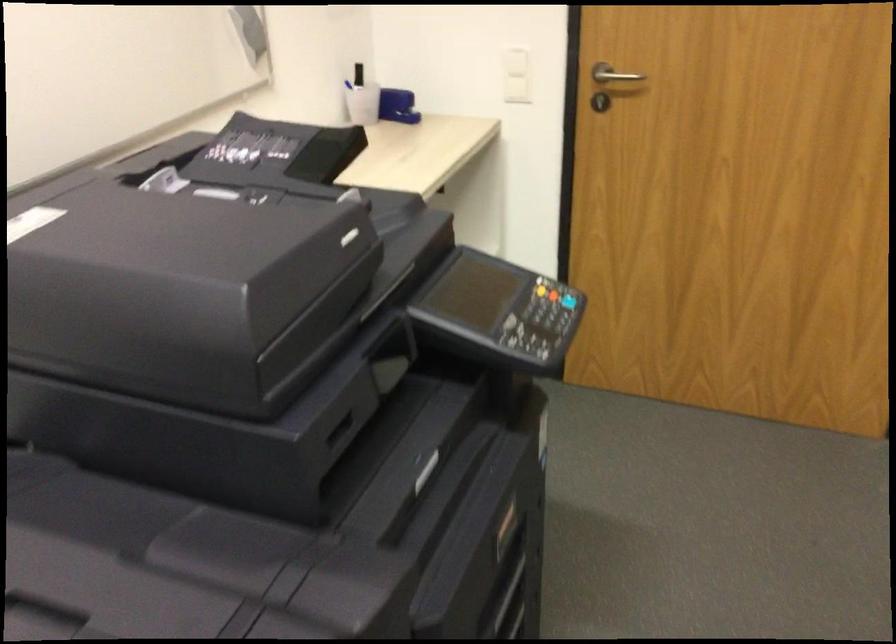
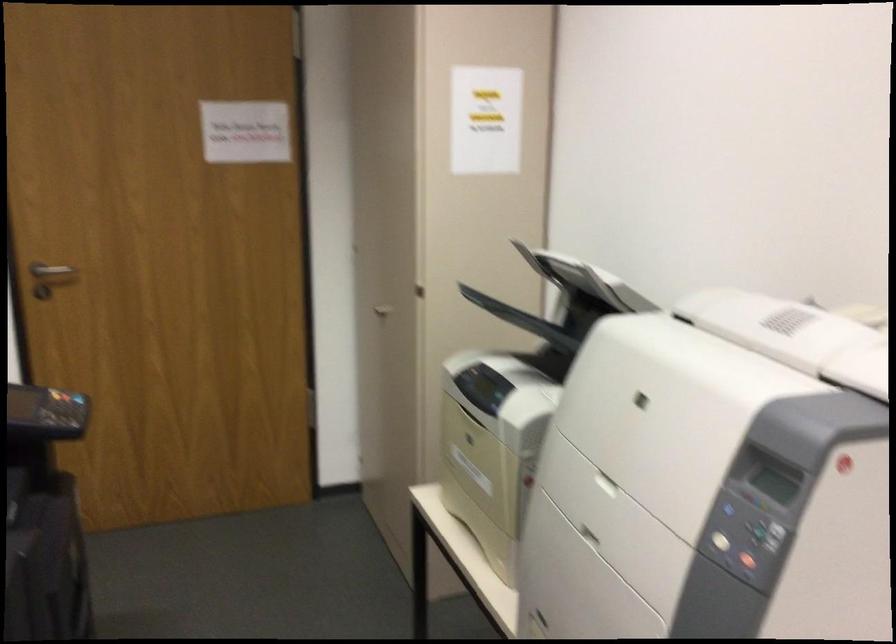
The point at (x=617, y=102) is marked in the first image. Where is the corresponding point in the second image?

(52, 274)